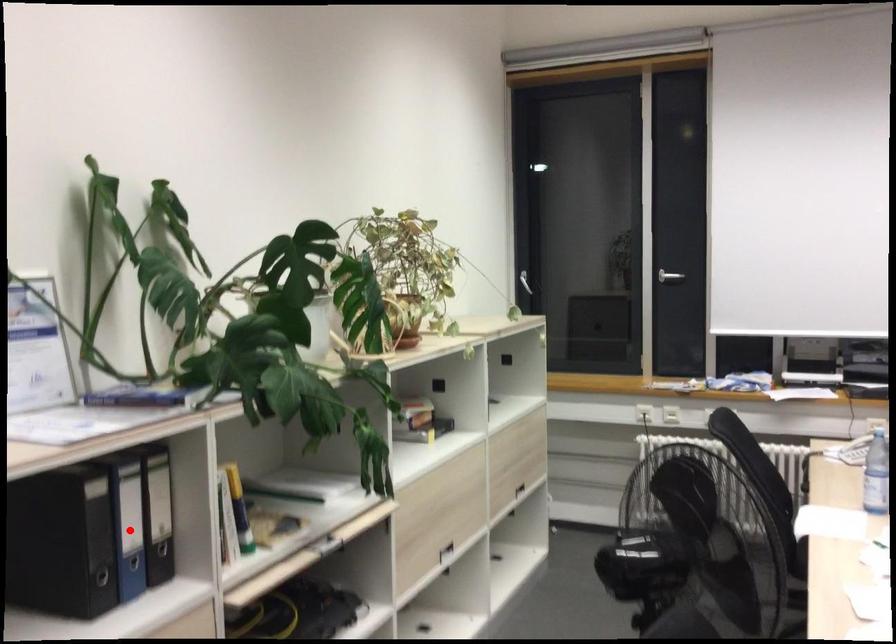
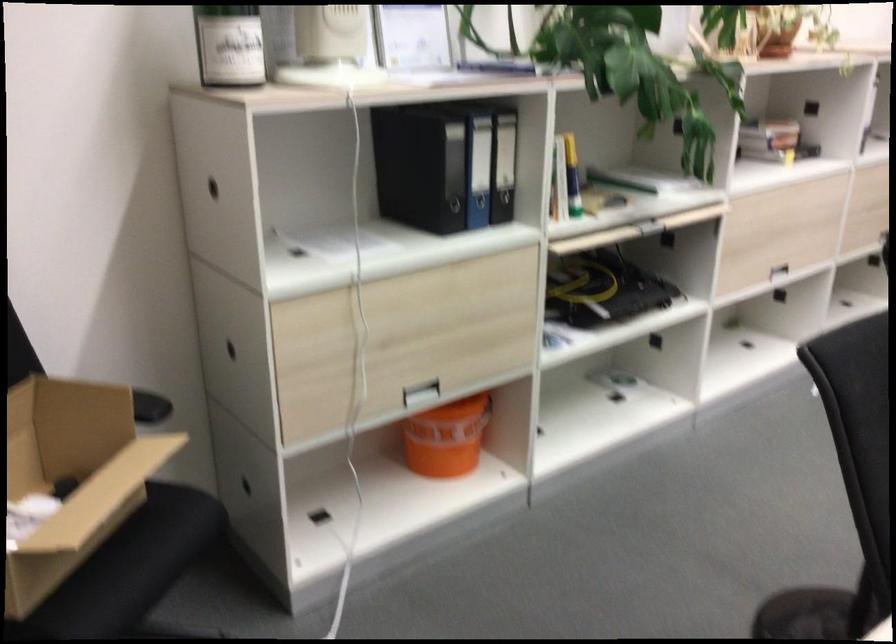
Where in the second image is the point corresponding to the highlighted location from the first image?

(478, 169)